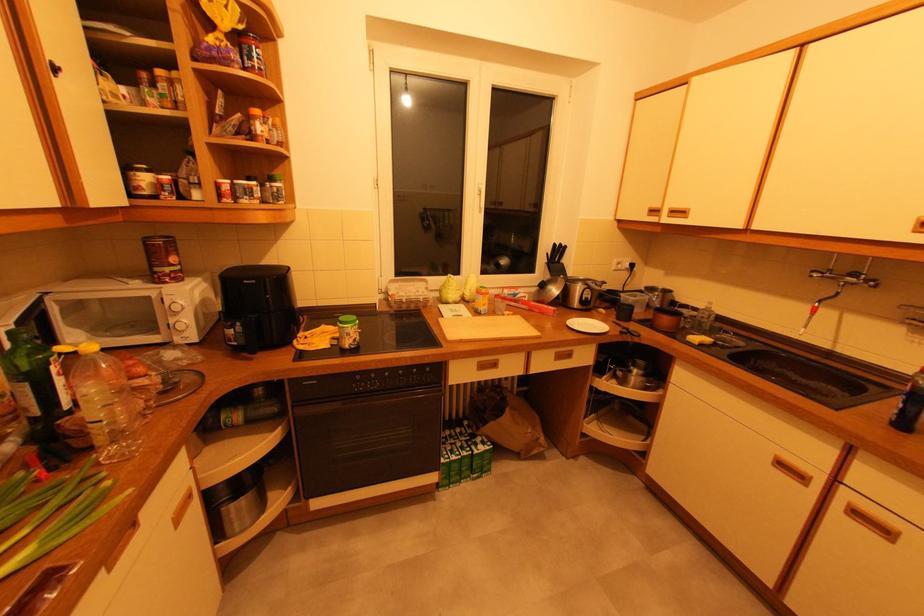
Where is `black oven knob`? The width and height of the screenshot is (924, 616). black oven knob is located at coordinates (304, 390).